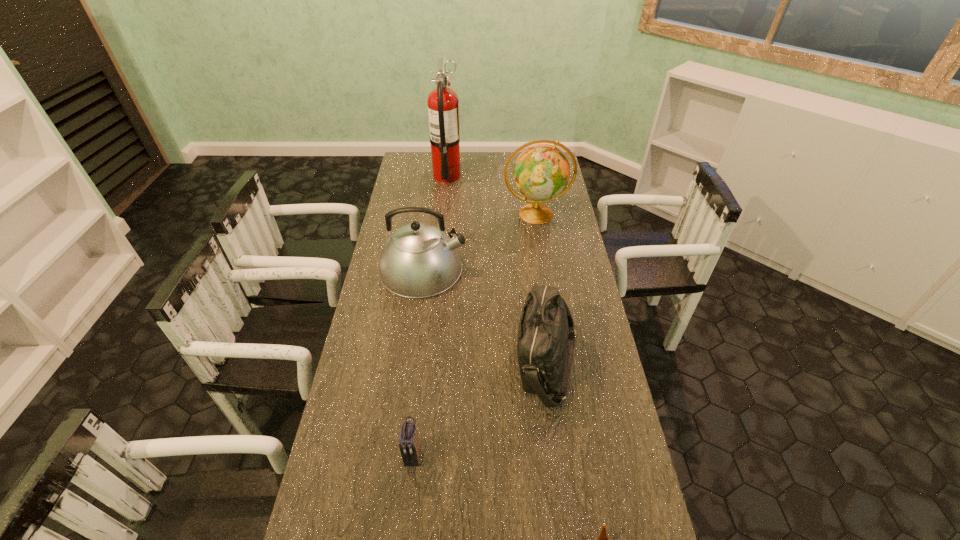
This screenshot has height=540, width=960. Identify the location of free spot at the right edge of the desktop. pos(607,370).

In the image, there is a desktop. Where is `blank space at the far left corner`? The height and width of the screenshot is (540, 960). blank space at the far left corner is located at coordinates (426, 152).

At what (x,y) coordinates should I click in order to perform the action: click on empty space between the fourth farthest object and the third farthest object. Please return your answer as a coordinate pair (x, y). The width and height of the screenshot is (960, 540). Looking at the image, I should click on (485, 316).

What are the coordinates of `free area in between the fifth shortest object and the third farthest object` in the screenshot? It's located at (479, 241).

Where is `empty space that is in between the kettle and the fifth farthest object`? empty space that is in between the kettle and the fifth farthest object is located at coordinates (418, 362).

The width and height of the screenshot is (960, 540). What are the coordinates of `free space between the fourth nearest object and the clutch bag` in the screenshot? It's located at (418, 362).

At what (x,y) coordinates should I click in order to perform the action: click on free point between the second farthest object and the fire extinguisher. Please return your answer as a coordinate pair (x, y). This screenshot has width=960, height=540. Looking at the image, I should click on (492, 195).

Identify the location of vacant region between the fourth farthest object and the fourth nearest object. This screenshot has height=540, width=960. (485, 316).

Find the location of a particular element. The width and height of the screenshot is (960, 540). vacant area that lies between the second nearest object and the globe is located at coordinates (475, 335).

Locate which object ranks fourth in proximity to the fourth nearest object. Please provide its 2D coordinates. Your answer should be formatted as a tuple, i.e. [(x, y)], where the tuple contains the x and y coordinates of a point satisfying the conditions above.

[(409, 447)]